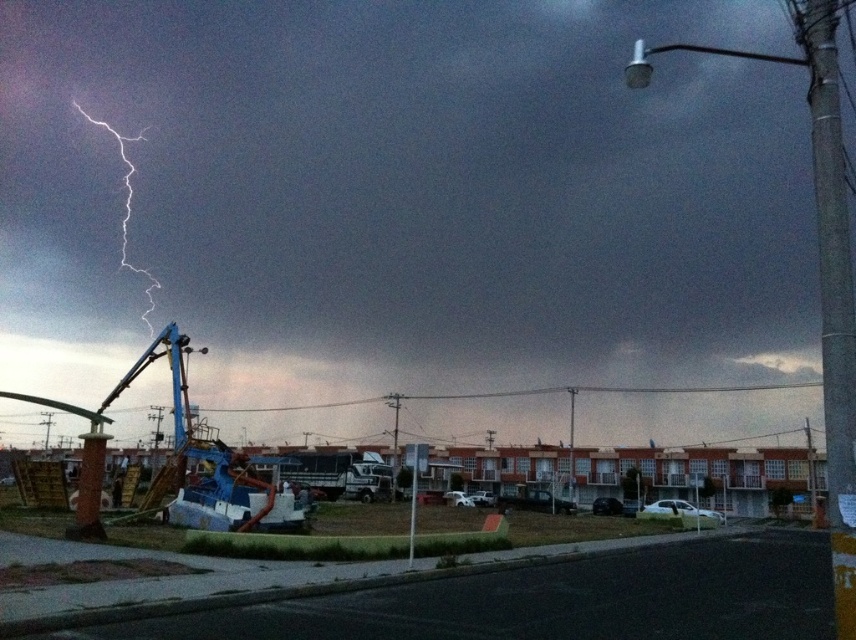
Question: Is metallic lightning bolt at upper left further to camera compared to metallic pole at center?

Choices:
 (A) yes
 (B) no

Answer: (B)

Question: Among these objects, which one is farthest from the camera?

Choices:
 (A) metallic pole at center
 (B) metallic lightning bolt at upper left

Answer: (A)

Question: Is metallic lightning bolt at upper left positioned at the back of metallic pole at center?

Choices:
 (A) no
 (B) yes

Answer: (A)

Question: Among these points, which one is nearest to the camera?

Choices:
 (A) (9, 88)
 (B) (569, 484)

Answer: (B)

Question: Can you confirm if metallic lightning bolt at upper left is smaller than metallic pole at center?

Choices:
 (A) no
 (B) yes

Answer: (A)

Question: Which of the following is the closest to the observer?

Choices:
 (A) (568, 483)
 (B) (400, 93)

Answer: (A)